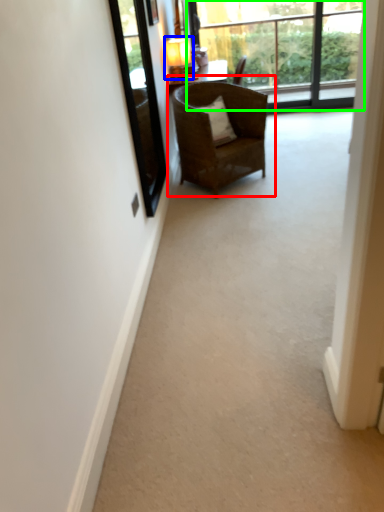
Question: Which object is positioned farthest from chair (highlighted by a red box)? Select from lamp (highlighted by a blue box) and window (highlighted by a green box).

Choices:
 (A) lamp
 (B) window

Answer: (B)